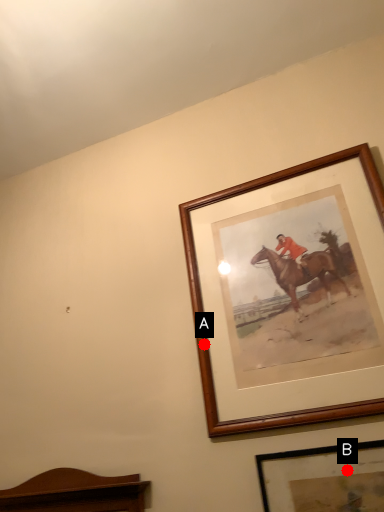
Question: Two points are circled on the image, labeled by A and B beside each circle. Which point is closer to the camera taking this photo?

Choices:
 (A) A is closer
 (B) B is closer

Answer: (B)